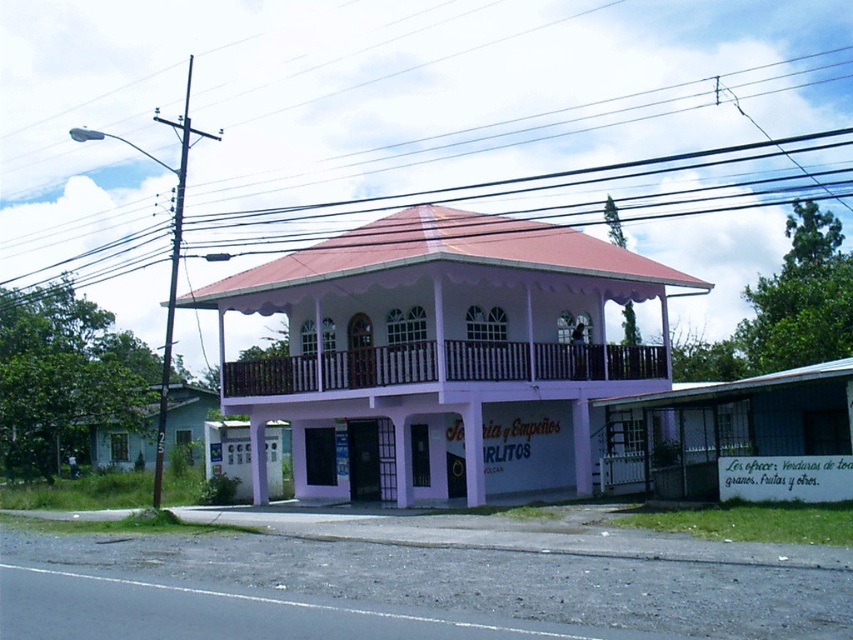
You are standing on the sidewalk in front of the two story building and see both the white matte gazebo at center and the black wire at upper center. Which object is positioned to the right of the other?

The white matte gazebo at center is to the right of black wire at upper center.

You are standing in front of the two story building and want to take a photo of the white matte gazebo at center and the black wire at upper center. Which object will appear larger in your photo?

A: The white matte gazebo at center will appear larger in the photo because it is closer to the viewer than the black wire at upper center.

You are standing at the entrance of the building and want to find the white matte gazebo at center. According to the coordinates, where should you look relative to the building?

The white matte gazebo at center is located at the coordinates point (440, 349), which is near the center of the image. Since the building is the main subject, the gazebo is likely positioned in the middle area of the scene, possibly in front of or adjacent to the building.